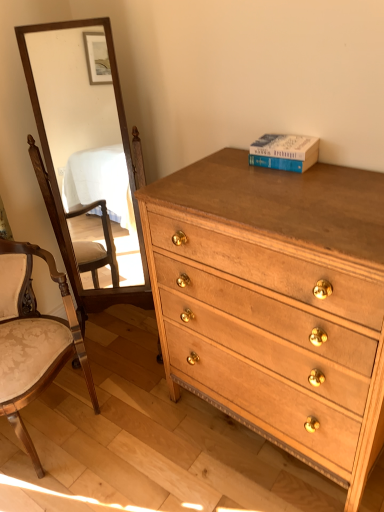
You are a GUI agent. You are given a task and a screenshot of the screen. Output one action in this format:
    pyautogui.click(x=<x>, y=<y>)
    Task: Click on the vacant space in between wooden mirror at left and wooden upholstered chair at left
    
    Given the screenshot: What is the action you would take?
    pyautogui.click(x=129, y=383)